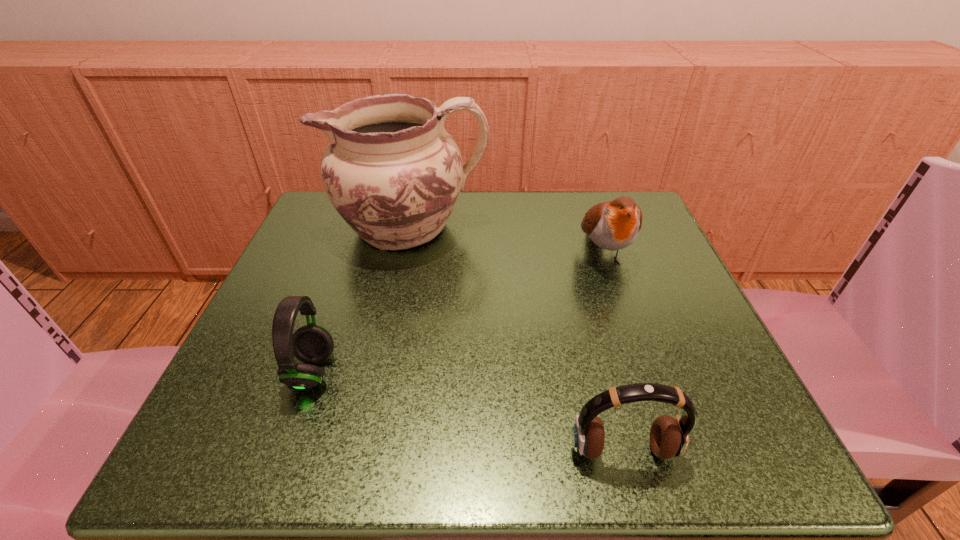
You are a GUI agent. You are given a task and a screenshot of the screen. Output one action in this format:
    pyautogui.click(x=<x>, y=<y>)
    Task: Click on the object present at the near edge
    The width and height of the screenshot is (960, 540).
    Given the screenshot: What is the action you would take?
    point(669,437)

Identify the location of pitcher that is positioned at the left edge. tap(393, 173).

Identify the location of headset that is at the left edge. The height and width of the screenshot is (540, 960). (312, 344).

You are a GUI agent. You are given a task and a screenshot of the screen. Output one action in this format:
    pyautogui.click(x=<x>, y=<y>)
    Task: Click on the bird that is positioned at the right edge
    Image resolution: width=960 pixels, height=540 pixels.
    Given the screenshot: What is the action you would take?
    pyautogui.click(x=613, y=225)

Image resolution: width=960 pixels, height=540 pixels. Identify the location of headset that is at the right edge. (669, 437).

I want to click on object that is positioned at the far left corner, so click(x=393, y=173).

Image resolution: width=960 pixels, height=540 pixels. Identify the location of object positioned at the far right corner. (613, 225).

Identify the location of object present at the near right corner. (669, 437).

At what (x,y) coordinates should I click in order to perform the action: click on free region at the far edge of the desktop. Please return your answer as a coordinate pair (x, y). The image size is (960, 540). Looking at the image, I should click on (492, 246).

This screenshot has height=540, width=960. Identify the location of free spot at the near edge of the desktop. (572, 421).